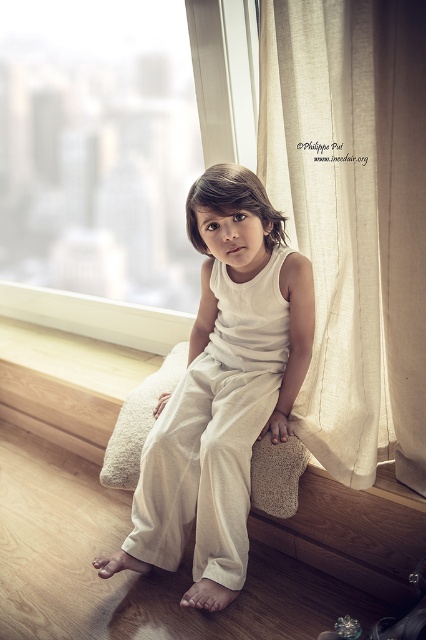
Question: Among these points, which one is nearest to the camera?

Choices:
 (A) (141, 20)
 (B) (345, 572)
 (C) (287, 262)
 (D) (365, 336)

Answer: (D)

Question: Does transparent glass window at center appear under wooden ledge at center?

Choices:
 (A) no
 (B) yes

Answer: (A)

Question: Which point is closer to the camera?

Choices:
 (A) (14, 394)
 (B) (414, 300)
 (C) (137, 212)

Answer: (B)

Question: Can you confirm if transparent glass window at center is positioned above wooden ledge at center?

Choices:
 (A) no
 (B) yes

Answer: (B)

Question: Is transparent glass window at center in front of wooden ledge at center?

Choices:
 (A) no
 (B) yes

Answer: (B)

Question: Among these points, which one is farthest from the camera?

Choices:
 (A) (28, 100)
 (B) (373, 500)
 (C) (420, 20)
 (D) (218, 221)

Answer: (A)